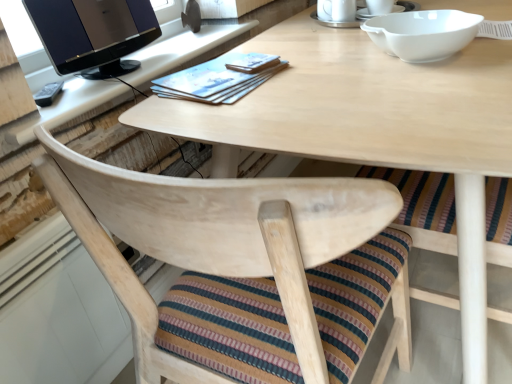
Question: Considering the relative sizes of satin black monitor at upper left and white ceramic mug at upper center in the image provided, is satin black monitor at upper left shorter than white ceramic mug at upper center?

Choices:
 (A) no
 (B) yes

Answer: (A)

Question: Is satin black monitor at upper left to the left of white ceramic mug at upper center from the viewer's perspective?

Choices:
 (A) no
 (B) yes

Answer: (B)

Question: From the image's perspective, is satin black monitor at upper left below white ceramic mug at upper center?

Choices:
 (A) no
 (B) yes

Answer: (B)

Question: Considering the relative sizes of satin black monitor at upper left and white ceramic mug at upper center in the image provided, is satin black monitor at upper left wider than white ceramic mug at upper center?

Choices:
 (A) yes
 (B) no

Answer: (A)

Question: Is satin black monitor at upper left bigger than white ceramic mug at upper center?

Choices:
 (A) yes
 (B) no

Answer: (A)

Question: Considering the positions of point 360,16 and point 231,178, is point 360,16 closer or farther from the camera than point 231,178?

Choices:
 (A) farther
 (B) closer

Answer: (A)

Question: From a real-world perspective, is white ceramic saucer at upper center, positioned as the first saucer in right-to-left order, positioned above or below natural wood chair at center?

Choices:
 (A) above
 (B) below

Answer: (A)

Question: Is white ceramic saucer at upper center, positioned as the first saucer in right-to-left order, wider or thinner than natural wood chair at center?

Choices:
 (A) wide
 (B) thin

Answer: (B)

Question: Relative to natural wood chair at center, is white ceramic saucer at upper center, placed as the 2th saucer when sorted from left to right, in front or behind?

Choices:
 (A) front
 (B) behind

Answer: (B)

Question: From a real-world perspective, is white ceramic saucer at upper center, positioned as the first saucer in right-to-left order, above or below satin black monitor at upper left?

Choices:
 (A) below
 (B) above

Answer: (A)

Question: Looking at the image, does white ceramic saucer at upper center, placed as the 2th saucer when sorted from left to right, seem bigger or smaller compared to satin black monitor at upper left?

Choices:
 (A) small
 (B) big

Answer: (A)

Question: Visually, is white ceramic saucer at upper center, placed as the 2th saucer when sorted from left to right, positioned to the left or to the right of satin black monitor at upper left?

Choices:
 (A) right
 (B) left

Answer: (A)

Question: In terms of width, does white ceramic saucer at upper center, positioned as the first saucer in right-to-left order, look wider or thinner when compared to satin black monitor at upper left?

Choices:
 (A) wide
 (B) thin

Answer: (B)

Question: In the image, is satin black monitor at upper left positioned in front of or behind white ceramic mug at upper center?

Choices:
 (A) front
 (B) behind

Answer: (A)

Question: Is satin black monitor at upper left wider or thinner than white ceramic mug at upper center?

Choices:
 (A) thin
 (B) wide

Answer: (B)